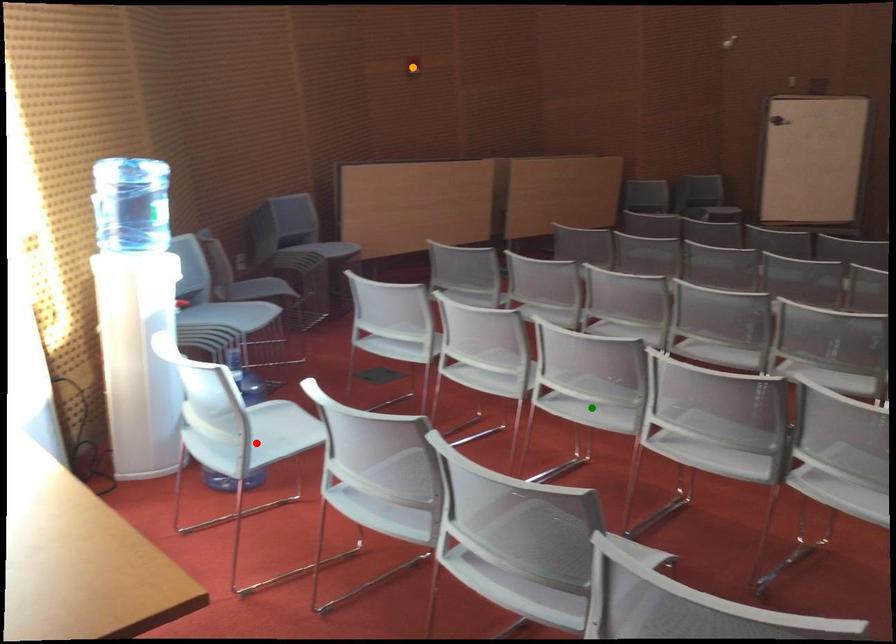
Order these from farthest to nearest:
orange point, green point, red point

orange point < green point < red point